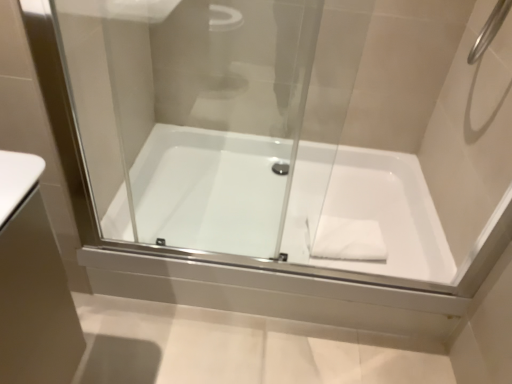
Question: Is point (78, 72) closer or farther from the camera than point (335, 165)?

Choices:
 (A) closer
 (B) farther

Answer: (A)

Question: Visually, is transparent glass door at center positioned to the left or to the right of white glossy bathtub at center?

Choices:
 (A) right
 (B) left

Answer: (A)

Question: Estimate the real-world distances between objects in this image. Which object is closer to the transparent glass door at center?

Choices:
 (A) white glossy bathtub at center
 (B) white matte hand towel at center

Answer: (A)

Question: Estimate the real-world distances between objects in this image. Which object is closer to the white glossy bathtub at center?

Choices:
 (A) white matte hand towel at center
 (B) transparent glass door at center

Answer: (B)